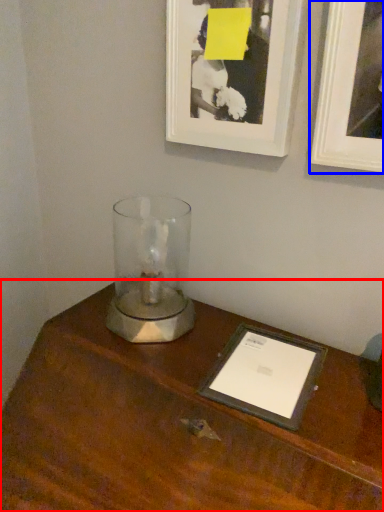
Question: Which object appears farthest to the camera in this image, table (highlighted by a red box) or picture frame (highlighted by a blue box)?

Choices:
 (A) table
 (B) picture frame

Answer: (B)